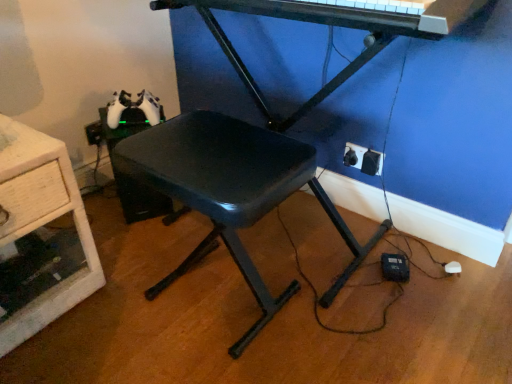
Question: Does metallic black piano at upper center have a greater width compared to wooden drawer at left?

Choices:
 (A) yes
 (B) no

Answer: (B)

Question: Is metallic black piano at upper center positioned beyond the bounds of wooden drawer at left?

Choices:
 (A) no
 (B) yes

Answer: (B)

Question: Is wooden drawer at left inside metallic black piano at upper center?

Choices:
 (A) yes
 (B) no

Answer: (B)

Question: Is metallic black piano at upper center facing away from wooden drawer at left?

Choices:
 (A) no
 (B) yes

Answer: (A)

Question: Does metallic black piano at upper center have a lesser width compared to wooden drawer at left?

Choices:
 (A) no
 (B) yes

Answer: (B)

Question: Is wooden drawer at left inside or outside of black plastic electric outlet at lower right, which is the 1th electric outlet from back to front?

Choices:
 (A) outside
 (B) inside

Answer: (A)

Question: Considering the positions of point (45, 248) and point (352, 163), is point (45, 248) closer or farther from the camera than point (352, 163)?

Choices:
 (A) closer
 (B) farther

Answer: (A)

Question: Considering the positions of wooden drawer at left and black plastic electric outlet at lower right, which is the 1th electric outlet from back to front, in the image, is wooden drawer at left wider or thinner than black plastic electric outlet at lower right, which is the 1th electric outlet from back to front,?

Choices:
 (A) thin
 (B) wide

Answer: (B)

Question: Relative to black plastic electric outlet at lower right, which is the 1th electric outlet from back to front, is wooden drawer at left in front or behind?

Choices:
 (A) front
 (B) behind

Answer: (A)

Question: Do you think metallic black piano at upper center is within black plastic electric outlet at lower right, which ranks as the 2th electric outlet in front-to-back order, or outside of it?

Choices:
 (A) inside
 (B) outside

Answer: (B)

Question: Is point click(422, 33) positioned closer to the camera than point click(351, 157)?

Choices:
 (A) closer
 (B) farther

Answer: (A)

Question: From the image's perspective, is metallic black piano at upper center positioned above or below black plastic electric outlet at lower right, which ranks as the 2th electric outlet in front-to-back order?

Choices:
 (A) below
 (B) above

Answer: (B)

Question: Relative to black plastic electric outlet at lower right, which ranks as the 2th electric outlet in front-to-back order, is metallic black piano at upper center in front or behind?

Choices:
 (A) front
 (B) behind

Answer: (A)

Question: Relative to black plastic electric outlet at lower right, which is the 1th electric outlet from back to front, is black plastic stool at center in front or behind?

Choices:
 (A) front
 (B) behind

Answer: (A)

Question: In terms of size, does black plastic stool at center appear bigger or smaller than black plastic electric outlet at lower right, which is the 1th electric outlet from back to front?

Choices:
 (A) small
 (B) big

Answer: (B)